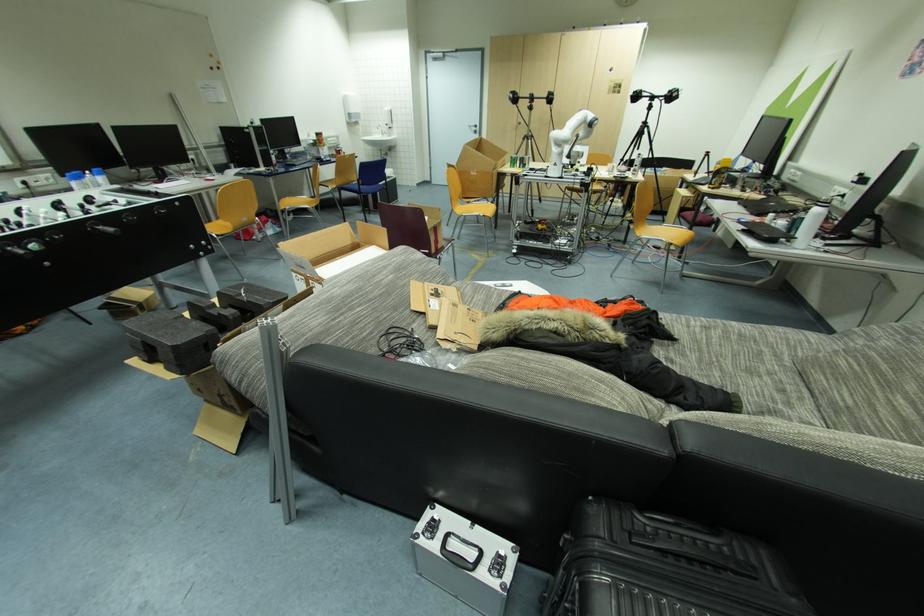
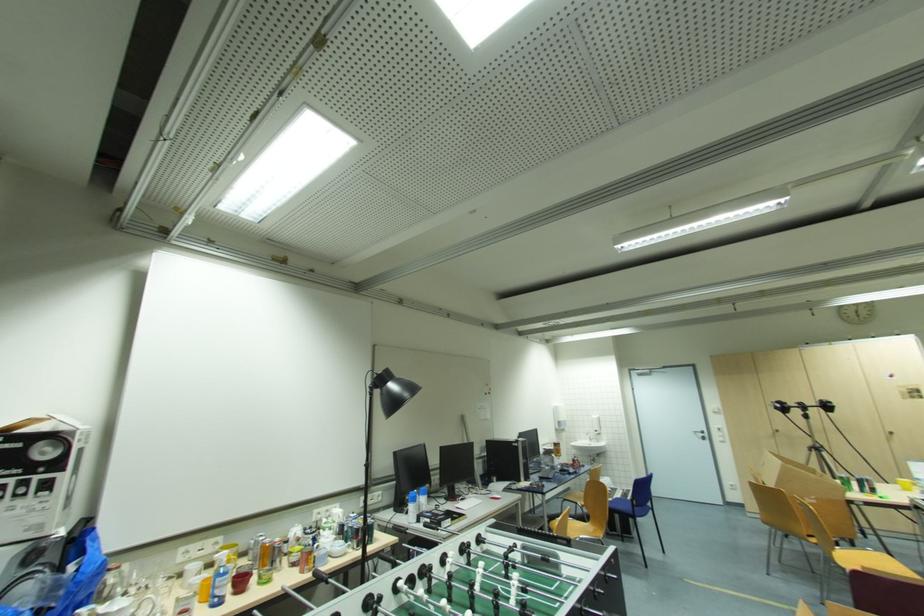
In the second image, find the point that corresponds to point 365,185 in the first image.

(639, 506)